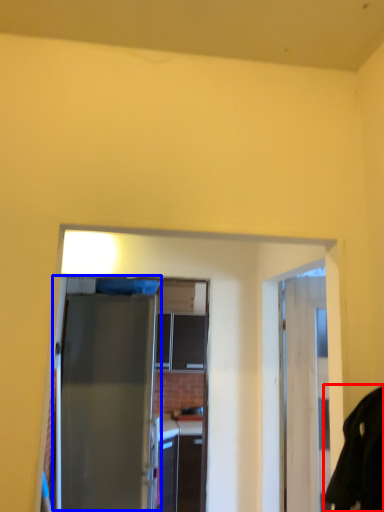
Question: Which of the following is the closest to the observer, robe (highlighted by a red box) or door (highlighted by a blue box)?

Choices:
 (A) robe
 (B) door

Answer: (A)